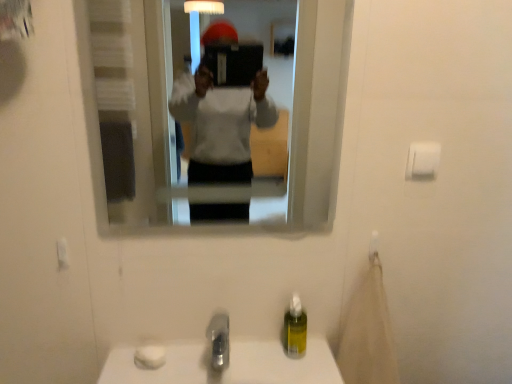
Question: Is clear glass mirror at upper center bigger or smaller than white matte toilet paper at upper right?

Choices:
 (A) big
 (B) small

Answer: (A)

Question: From a real-world perspective, is clear glass mirror at upper center physically located above or below white matte toilet paper at upper right?

Choices:
 (A) below
 (B) above

Answer: (B)

Question: Which object is the closest to the satin nickel faucet at lower center?

Choices:
 (A) white matte toilet paper at upper right
 (B) clear glass mirror at upper center
 (C) yellow translucent soap dispenser at lower center

Answer: (C)

Question: Based on their relative distances, which object is farther from the yellow translucent soap dispenser at lower center?

Choices:
 (A) satin nickel faucet at lower center
 (B) clear glass mirror at upper center
 (C) white matte toilet paper at upper right

Answer: (B)